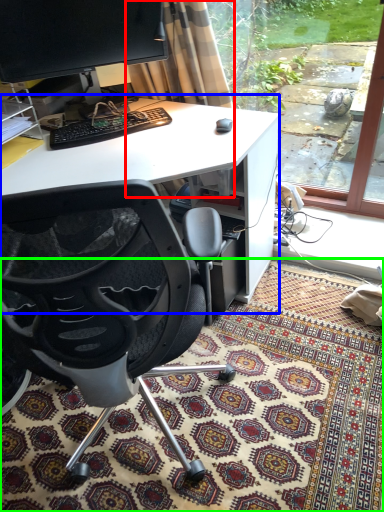
Question: Estimate the real-world distances between objects in this image. Which object is farther from curtain (highlighted by a red box), desk (highlighted by a blue box) or mat (highlighted by a green box)?

Choices:
 (A) desk
 (B) mat

Answer: (B)